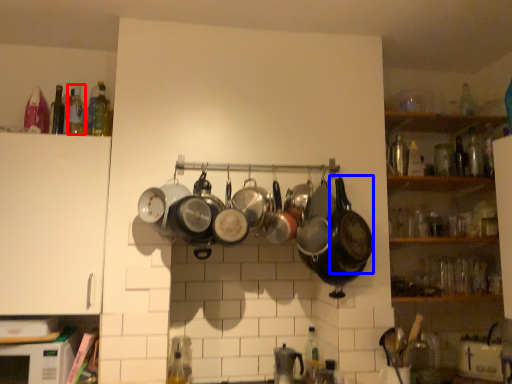
Question: Which of the following is the farthest to the observer, bottle (highlighted by a red box) or wok (highlighted by a blue box)?

Choices:
 (A) bottle
 (B) wok

Answer: (A)